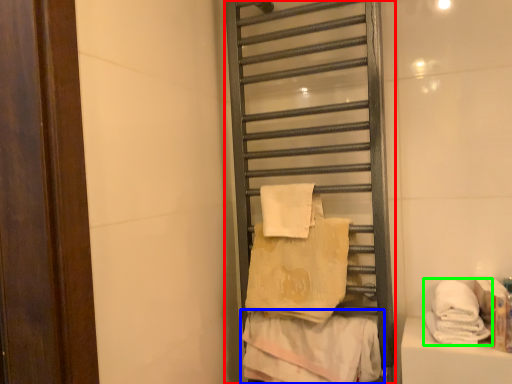
Question: Which object is the farthest from shelf (highlighted by a red box)? Choose among these: towel (highlighted by a blue box) or towel (highlighted by a green box).

Choices:
 (A) towel
 (B) towel

Answer: (B)